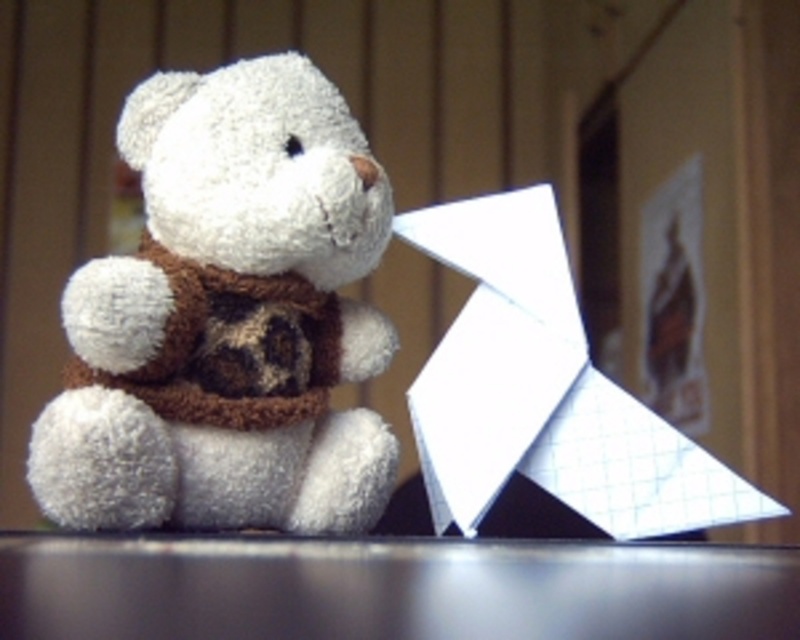
Does black glossy table at lower center have a greater width compared to white paper at right?

Indeed, black glossy table at lower center has a greater width compared to white paper at right.

Which of these two, black glossy table at lower center or white paper at right, stands shorter?

Standing shorter between the two is black glossy table at lower center.

Which is in front, point (385, 554) or point (572, 406)?

Point (385, 554)

Identify the location of black glossy table at lower center. The image size is (800, 640). (388, 588).

Is white plush teddy bear at center taller than white paper at right?

Correct, white plush teddy bear at center is much taller as white paper at right.

This screenshot has width=800, height=640. Describe the element at coordinates (228, 317) in the screenshot. I see `white plush teddy bear at center` at that location.

Measure the distance between white plush teddy bear at center and camera.

white plush teddy bear at center is 34.25 inches away from camera.

Where is `white plush teddy bear at center`? Image resolution: width=800 pixels, height=640 pixels. white plush teddy bear at center is located at coordinates (228, 317).

Is white plush teddy bear at center wider than black glossy table at lower center?

No, white plush teddy bear at center is not wider than black glossy table at lower center.

Can you confirm if white plush teddy bear at center is smaller than black glossy table at lower center?

Actually, white plush teddy bear at center might be larger than black glossy table at lower center.

Is point (198, 420) closer to viewer compared to point (368, 636)?

No.

Locate an element on the screen. The width and height of the screenshot is (800, 640). white plush teddy bear at center is located at coordinates (228, 317).